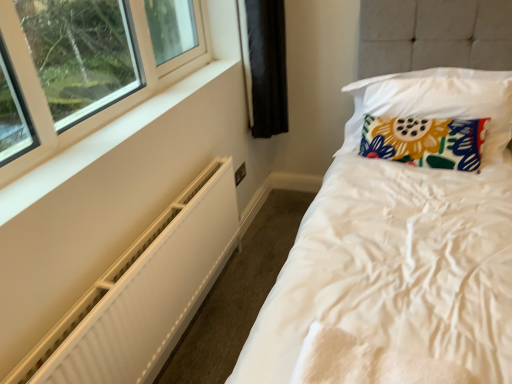
Question: Does floral fabric pillow at upper right, which ranks as the second pillow in bottom-to-top order, have a lesser height compared to white textured radiator at lower left?

Choices:
 (A) no
 (B) yes

Answer: (B)

Question: Considering the relative sizes of floral fabric pillow at upper right, which ranks as the second pillow in bottom-to-top order, and white textured radiator at lower left in the image provided, is floral fabric pillow at upper right, which ranks as the second pillow in bottom-to-top order, taller than white textured radiator at lower left?

Choices:
 (A) no
 (B) yes

Answer: (A)

Question: Does floral fabric pillow at upper right, which is the first pillow from top to bottom, have a greater width compared to white textured radiator at lower left?

Choices:
 (A) no
 (B) yes

Answer: (B)

Question: Considering the relative positions of floral fabric pillow at upper right, which is the first pillow from top to bottom, and white textured radiator at lower left in the image provided, is floral fabric pillow at upper right, which is the first pillow from top to bottom, to the right of white textured radiator at lower left from the viewer's perspective?

Choices:
 (A) yes
 (B) no

Answer: (A)

Question: From a real-world perspective, does floral fabric pillow at upper right, which is the first pillow from top to bottom, stand above white textured radiator at lower left?

Choices:
 (A) no
 (B) yes

Answer: (B)

Question: In the image, is floral fabric pillow at upper right, arranged as the first pillow when ordered from the bottom, positioned in front of or behind floral fabric pillow at upper right, which ranks as the second pillow in bottom-to-top order?

Choices:
 (A) behind
 (B) front

Answer: (A)

Question: From a real-world perspective, relative to floral fabric pillow at upper right, which ranks as the second pillow in bottom-to-top order, is floral fabric pillow at upper right, the 2th pillow positioned from the top, vertically above or below?

Choices:
 (A) below
 (B) above

Answer: (A)

Question: In terms of width, does floral fabric pillow at upper right, arranged as the first pillow when ordered from the bottom, look wider or thinner when compared to floral fabric pillow at upper right, which is the first pillow from top to bottom?

Choices:
 (A) thin
 (B) wide

Answer: (A)

Question: Considering the relative positions of floral fabric pillow at upper right, arranged as the first pillow when ordered from the bottom, and floral fabric pillow at upper right, which is the first pillow from top to bottom, in the image provided, is floral fabric pillow at upper right, arranged as the first pillow when ordered from the bottom, to the left or to the right of floral fabric pillow at upper right, which is the first pillow from top to bottom,?

Choices:
 (A) left
 (B) right

Answer: (A)

Question: Looking at their shapes, would you say white textured radiator at lower left is wider or thinner than floral fabric pillow at upper right, arranged as the first pillow when ordered from the bottom?

Choices:
 (A) thin
 (B) wide

Answer: (A)

Question: Looking at the image, does white textured radiator at lower left seem bigger or smaller compared to floral fabric pillow at upper right, the 2th pillow positioned from the top?

Choices:
 (A) small
 (B) big

Answer: (B)

Question: Is point (90, 382) closer or farther from the camera than point (413, 144)?

Choices:
 (A) closer
 (B) farther

Answer: (A)

Question: From the image's perspective, relative to floral fabric pillow at upper right, arranged as the first pillow when ordered from the bottom, is white textured radiator at lower left above or below?

Choices:
 (A) below
 (B) above

Answer: (A)

Question: Looking at the image, does white textured radiator at lower left seem bigger or smaller compared to floral fabric pillow at upper right, which is the first pillow from top to bottom?

Choices:
 (A) small
 (B) big

Answer: (A)

Question: Is white textured radiator at lower left wider or thinner than floral fabric pillow at upper right, which is the first pillow from top to bottom?

Choices:
 (A) wide
 (B) thin

Answer: (B)